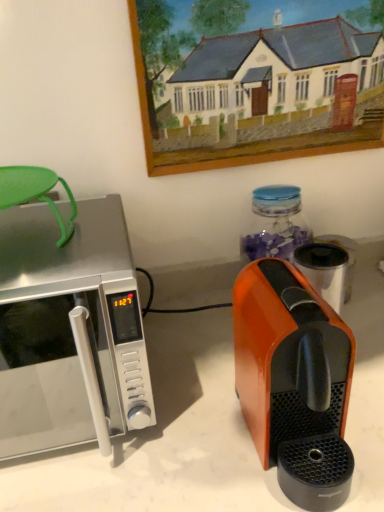
Find the location of `empty space that is ontop of satin silver microwave at left (from a real-world perspective)`. empty space that is ontop of satin silver microwave at left (from a real-world perspective) is located at coordinates (62, 239).